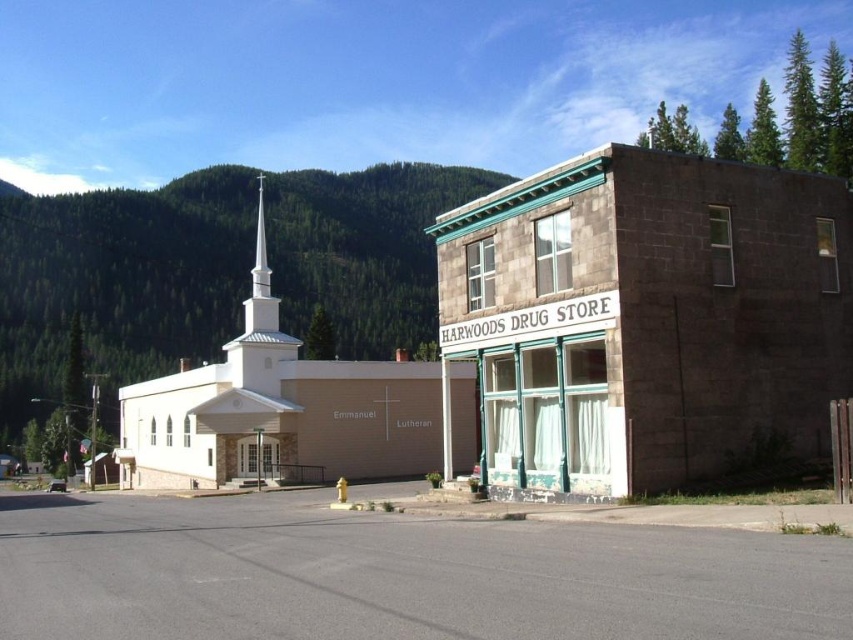
Question: Is the position of white smooth church at center less distant than that of white smooth steeple at center?

Choices:
 (A) yes
 (B) no

Answer: (A)

Question: Which point appears closest to the camera in this image?

Choices:
 (A) (830, 317)
 (B) (375, 449)

Answer: (A)

Question: Can you confirm if matte stone church at center is wider than white smooth church at center?

Choices:
 (A) no
 (B) yes

Answer: (A)

Question: Which of the following is the closest to the observer?

Choices:
 (A) (357, 474)
 (B) (554, 236)

Answer: (B)

Question: Is matte stone church at center in front of white smooth church at center?

Choices:
 (A) yes
 (B) no

Answer: (A)

Question: Which point is closer to the camera?

Choices:
 (A) white smooth church at center
 (B) matte stone church at center
 (C) white smooth steeple at center

Answer: (B)